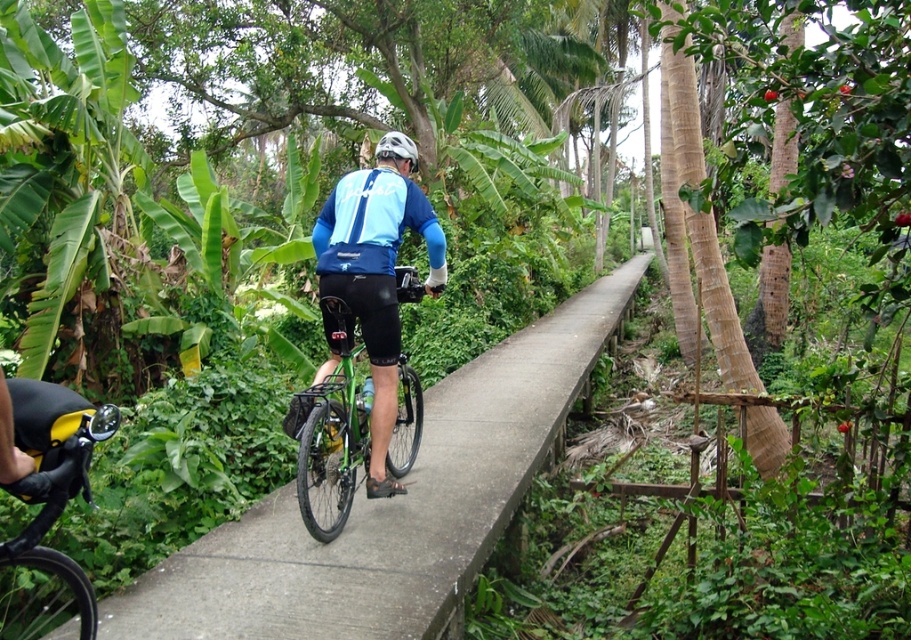
Question: Can you confirm if yellow matte bicycle handlebar at lower left is positioned to the right of white matte bicycle helmet at center?

Choices:
 (A) yes
 (B) no

Answer: (B)

Question: Which object appears farthest from the camera in this image?

Choices:
 (A) green matte bicycle at center
 (B) white matte bicycle helmet at center
 (C) concrete at center
 (D) yellow matte bicycle handlebar at lower left

Answer: (B)

Question: Observing the image, what is the correct spatial positioning of green matte bicycle at center in reference to white matte bicycle helmet at center?

Choices:
 (A) right
 (B) left

Answer: (A)

Question: Based on their relative distances, which object is farther from the concrete at center?

Choices:
 (A) green matte bicycle at center
 (B) yellow matte bicycle handlebar at lower left

Answer: (B)

Question: Which of these objects is positioned farthest from the green matte bicycle at center?

Choices:
 (A) white matte bicycle helmet at center
 (B) yellow matte bicycle handlebar at lower left
 (C) concrete at center

Answer: (B)

Question: Observing the image, what is the correct spatial positioning of yellow matte bicycle handlebar at lower left in reference to white matte bicycle helmet at center?

Choices:
 (A) below
 (B) above

Answer: (A)